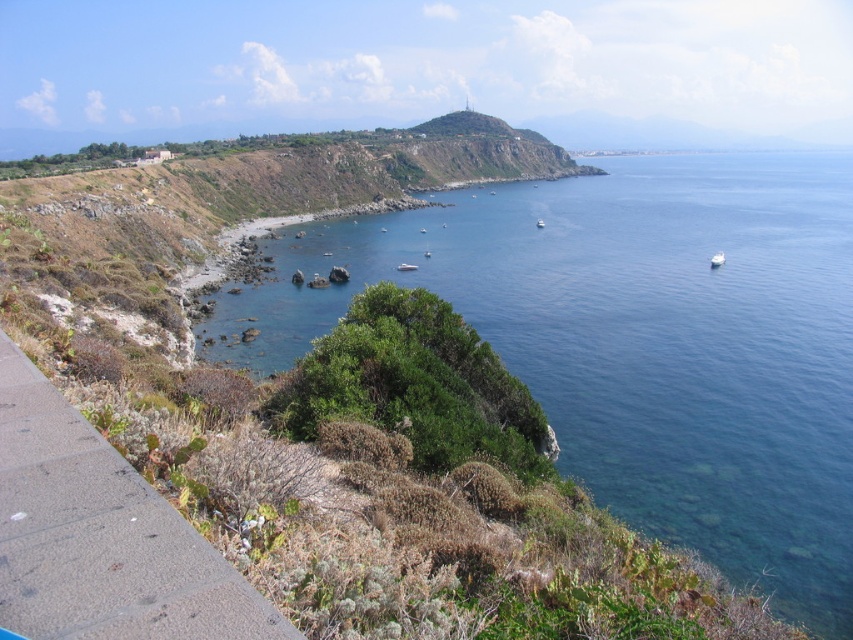
You are a landscape architect designing a new coastal walkway. You need to decide whether to place a 3m wide bench along the gray concrete sidewalk at lower left or near the blue clear water at center. Based on their widths, where should you place the bench to ensure it fits properly?

The blue clear water at center might be wider than the gray concrete sidewalk at lower left. Therefore, placing the 3m wide bench near the blue clear water at center is more likely to accommodate the bench without overcrowding the space.

You are standing on the cliffside walkway and see two white glossy boats in the water. Which boat, the white glossy boat at lower right or the white glossy boat at center, appears closer to the cliff? Explain your reasoning based on their positions.

The white glossy boat at lower right appears closer to the cliff because it is positioned above the white glossy boat at center. In the scene, objects higher in the image are typically closer to the viewer, so the boat at lower right being above the other suggests it is nearer to the cliffside walkway where you are standing.

You are a tourist standing on the gray concrete sidewalk at lower left and want to take a photo of the white glossy boat at center. Since the sidewalk is shorter than the boat, will you be able to capture the entire boat in your photo without moving?

The gray concrete sidewalk at lower left is shorter than the white glossy boat at center, so capturing the entire boat in the photo may be challenging due to the sidewalk being shorter than the boat.